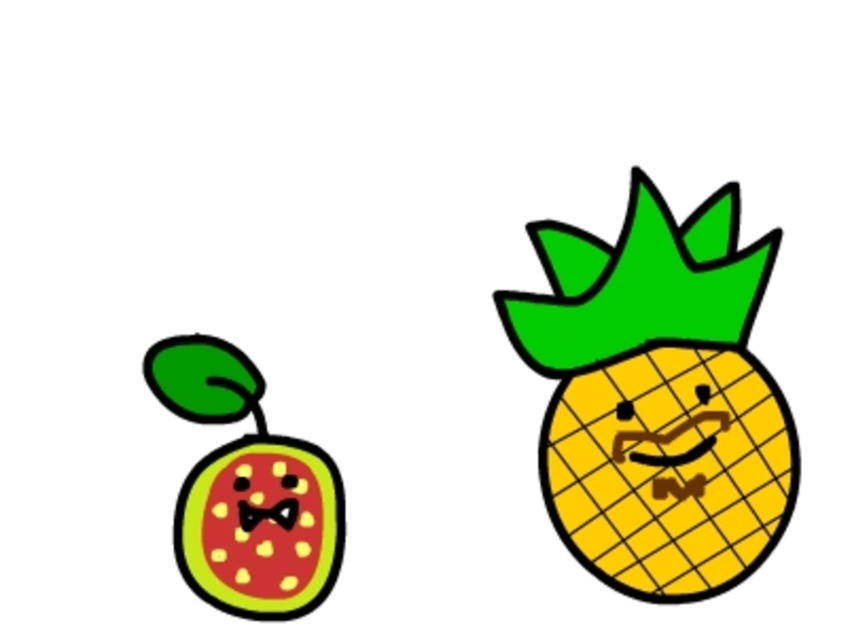
Question: Is yellow grid pineapple at right smaller than polka-dotted fabric face at left?

Choices:
 (A) no
 (B) yes

Answer: (A)

Question: Does matte green watermelon at left appear on the right side of polka-dotted fabric face at left?

Choices:
 (A) no
 (B) yes

Answer: (A)

Question: Which point is closer to the camera taking this photo?

Choices:
 (A) (296, 483)
 (B) (229, 596)

Answer: (B)

Question: Based on their relative distances, which object is farther from the polka-dotted fabric face at left?

Choices:
 (A) yellow grid pineapple at right
 (B) matte green watermelon at left

Answer: (A)

Question: Is matte green watermelon at left to the left of polka-dotted fabric face at left from the viewer's perspective?

Choices:
 (A) yes
 (B) no

Answer: (A)

Question: Which of these objects is positioned closest to the polka-dotted fabric face at left?

Choices:
 (A) matte green watermelon at left
 (B) yellow grid pineapple at right

Answer: (A)